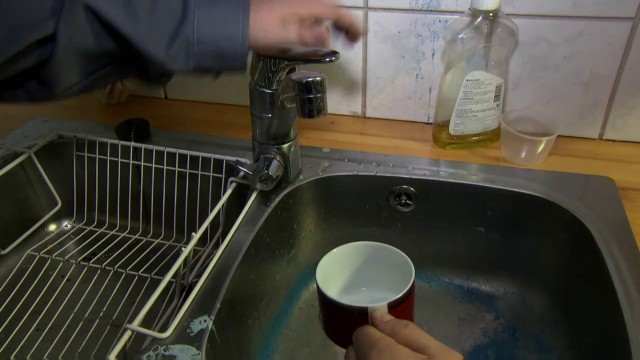
Locate an element on the screen. This screenshot has height=360, width=640. cup is located at coordinates (532, 153).